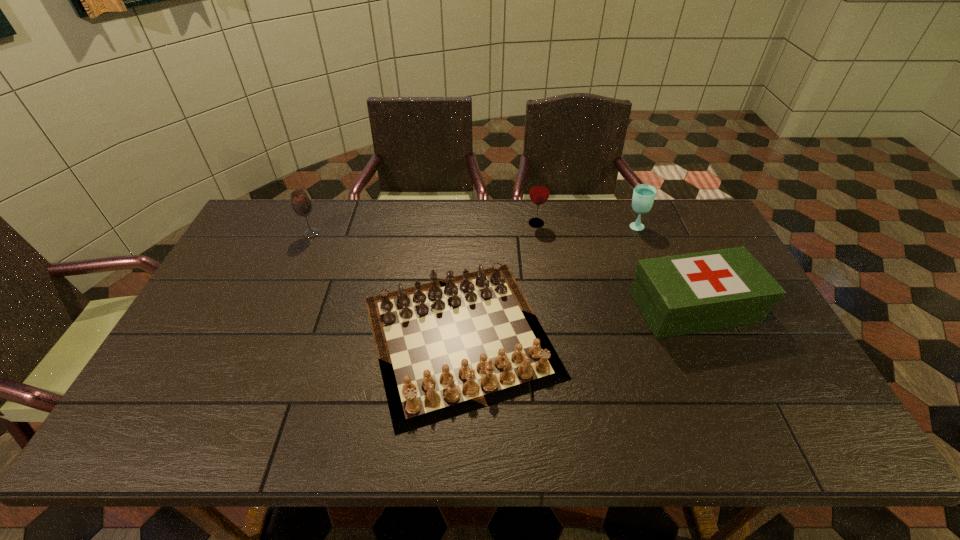
Find the location of a particular element. This screenshot has width=960, height=540. vacant space in between the rightmost glass and the second glass from right to left is located at coordinates (586, 225).

This screenshot has width=960, height=540. I want to click on unoccupied area between the rightmost glass and the second glass from right to left, so click(586, 225).

At what (x,y) coordinates should I click in order to perform the action: click on vacant area between the second glass from right to left and the leftmost object. Please return your answer as a coordinate pair (x, y). This screenshot has height=540, width=960. Looking at the image, I should click on (423, 228).

Locate an element on the screen. vacant area that lies between the second shortest object and the chessboard is located at coordinates (577, 321).

Locate which object is the third closest to the leftmost object. Please provide its 2D coordinates. Your answer should be formatted as a tuple, i.e. [(x, y)], where the tuple contains the x and y coordinates of a point satisfying the conditions above.

[(682, 294)]

Image resolution: width=960 pixels, height=540 pixels. What are the coordinates of `object that is the fourth closest one to the rightmost glass` in the screenshot? It's located at (301, 204).

Locate an element on the screen. This screenshot has width=960, height=540. the closest glass to the shortest object is located at coordinates (539, 192).

At what (x,y) coordinates should I click in order to perform the action: click on the closest glass to the rightmost glass. Please return your answer as a coordinate pair (x, y). This screenshot has height=540, width=960. Looking at the image, I should click on (539, 192).

Where is `vacant region that satisfies the following two spatial constraints: 1. on the front side of the second glass from right to left; 2. on the left side of the fourth tallest object`? The height and width of the screenshot is (540, 960). vacant region that satisfies the following two spatial constraints: 1. on the front side of the second glass from right to left; 2. on the left side of the fourth tallest object is located at coordinates (548, 308).